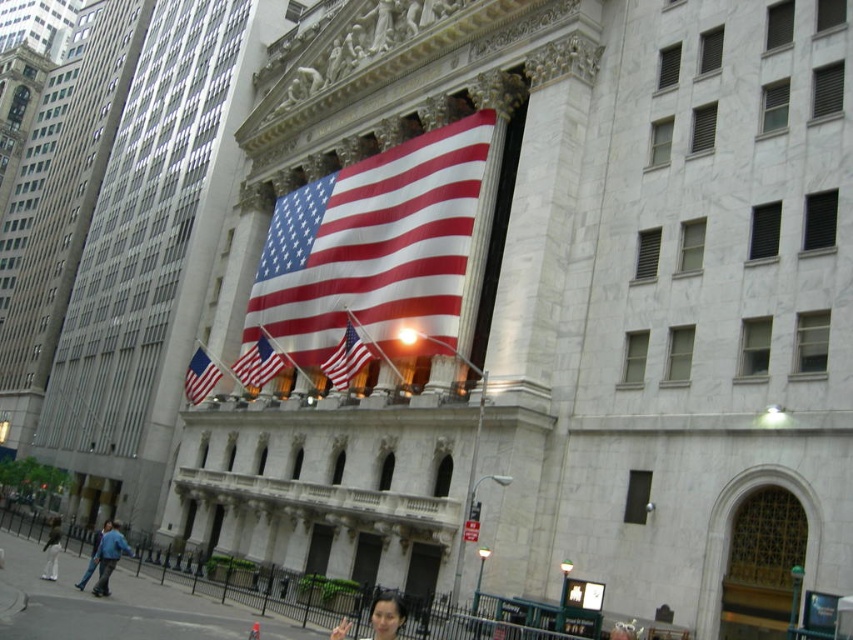
You are a photographer planning to take a portrait of someone wearing the white cotton pants at lower left and the blue jeans at lower left. Since you want to focus on the main subject, which clothing item should you position closer to the center of the frame to ensure it doesn t get lost in the background?

The white cotton pants at lower left occupies less space than blue jeans at lower left, so you should position the white cotton pants at lower left closer to the center of the frame to ensure it doesn t get lost in the background.